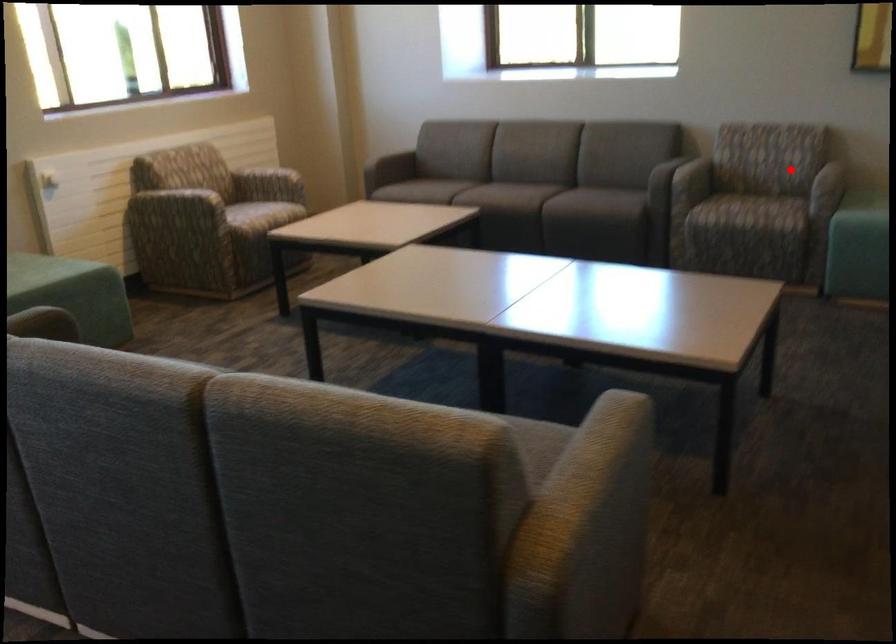
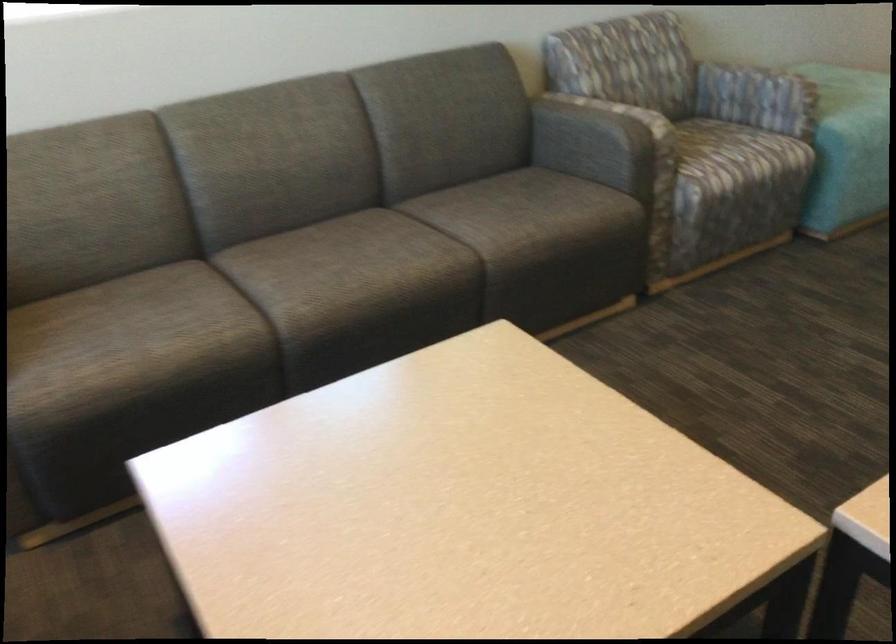
Question: I am providing you with two images of the same scene from different viewpoints. A red point is shown in image1. For the corresponding object point in image2, is it positioned nearer or farther from the camera?

Choices:
 (A) Nearer
 (B) Farther

Answer: (A)